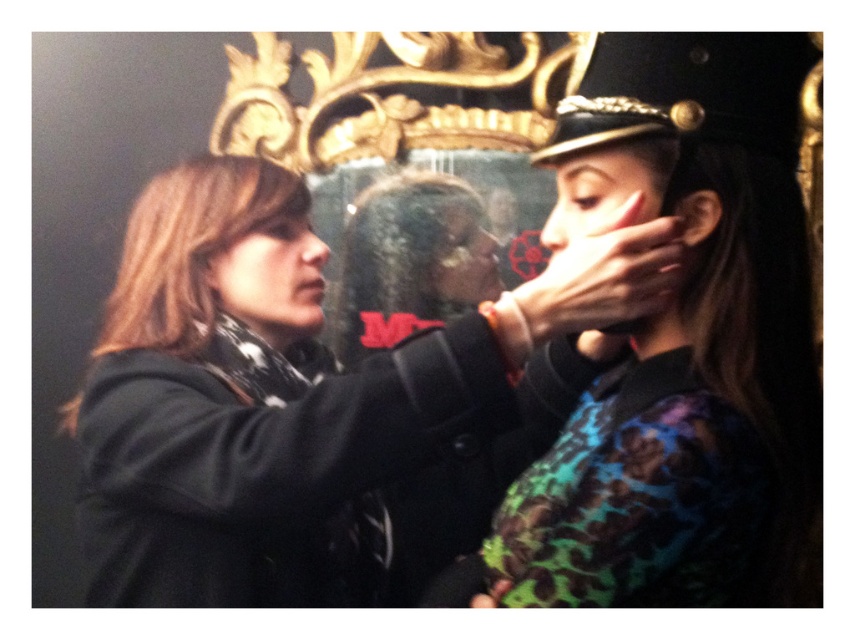
You are an interior designer analyzing the placement of objects in the image. The matte black jacket at center is located at coordinates point 0.627, 0.364. If the room has a coordinate system where the bottom left corner is 0,0 and the top right corner is 1,1, what is the jacket positioned closer to the bottom or the right side of the room?

The coordinates of the matte black jacket at center are 0.627 on the x axis and 0.364 on the y axis. Since 0.627 is closer to 1 on the x axis, the jacket is positioned closer to the right side of the room.